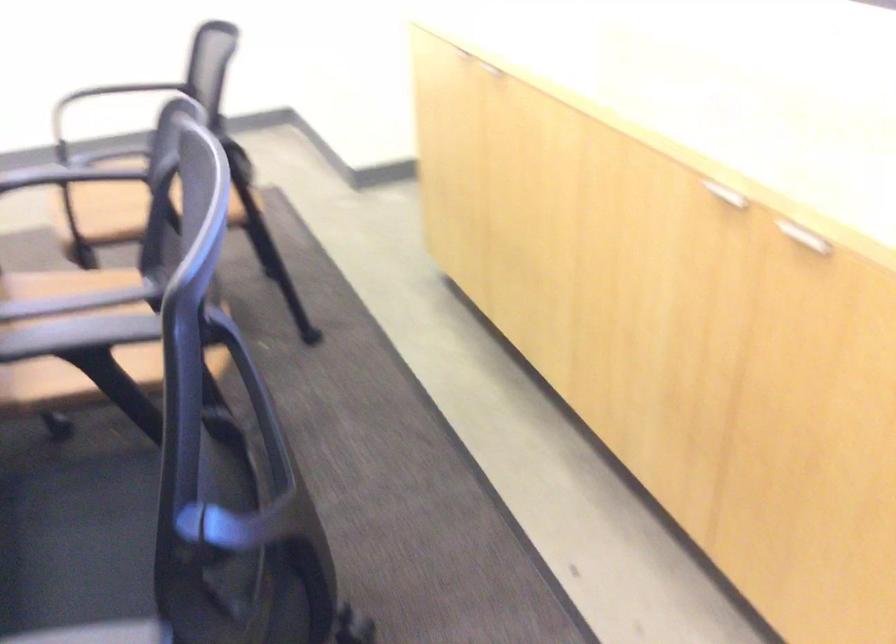
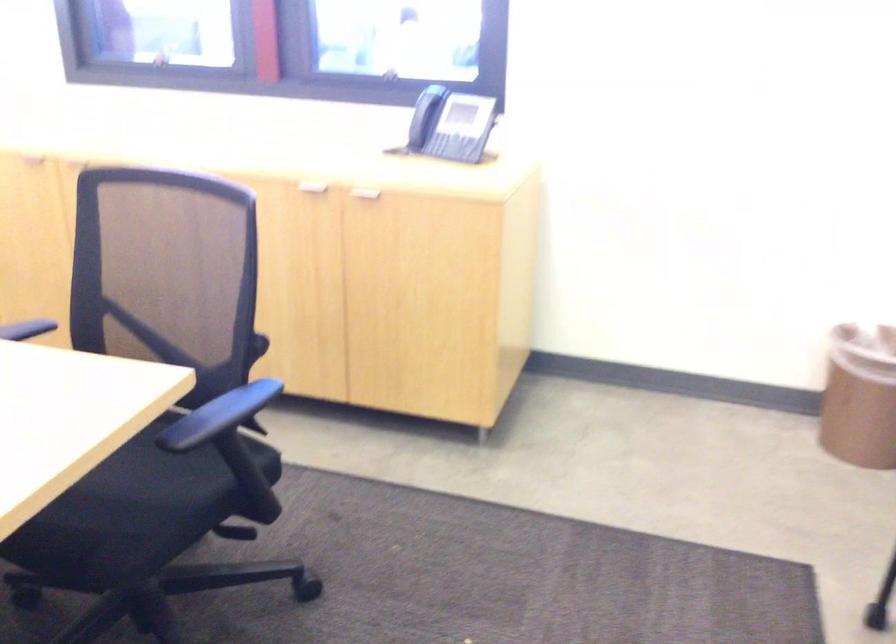
In the second image, find the point that corresponds to pixel 803 245 in the first image.

(364, 196)